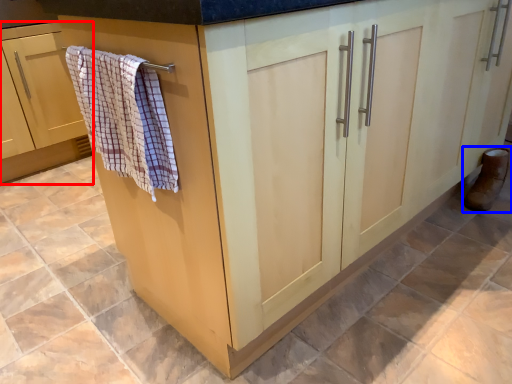
Question: Which point is further to the camera, cabinetry (highlighted by a red box) or footwear (highlighted by a blue box)?

Choices:
 (A) cabinetry
 (B) footwear

Answer: (A)